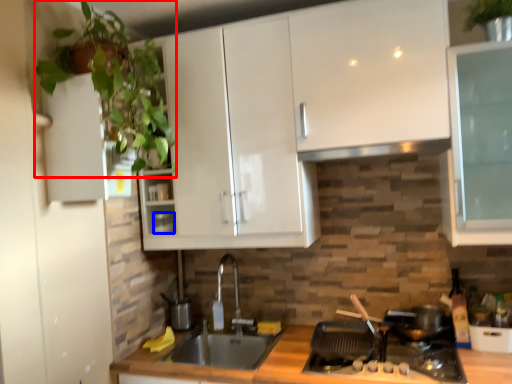
Question: Which object appears closest to the camera in this image, plant (highlighted by a red box) or appliance (highlighted by a blue box)?

Choices:
 (A) plant
 (B) appliance

Answer: (A)